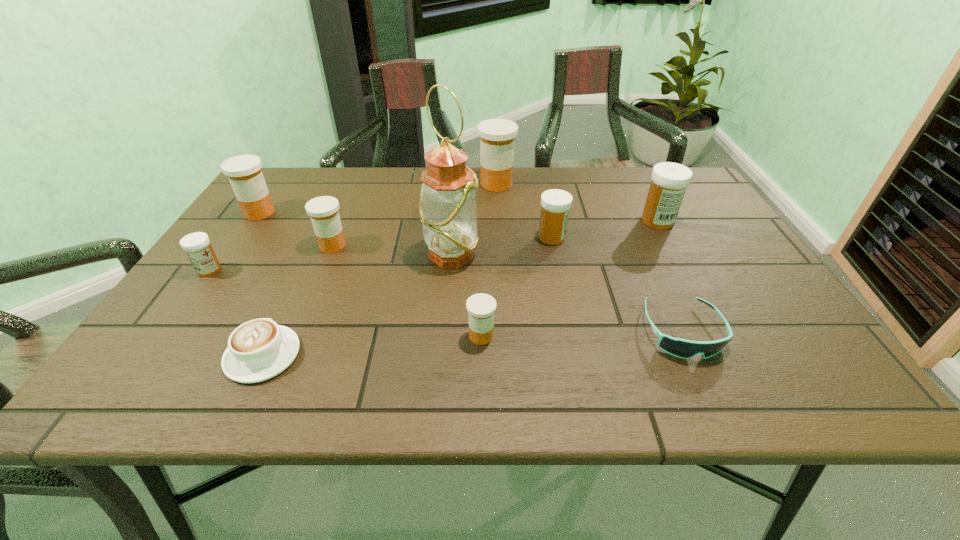
Find the location of `free space located 0.070m on the front-facing side of the sunglasses`. free space located 0.070m on the front-facing side of the sunglasses is located at coordinates (711, 395).

Image resolution: width=960 pixels, height=540 pixels. Identify the location of cappuccino that is at the near edge. (260, 349).

At what (x,y) coordinates should I click in order to perform the action: click on sunglasses present at the near edge. Please return your answer as a coordinate pair (x, y). This screenshot has width=960, height=540. Looking at the image, I should click on (682, 348).

Where is `object present at the right edge`? The height and width of the screenshot is (540, 960). object present at the right edge is located at coordinates (669, 181).

Image resolution: width=960 pixels, height=540 pixels. Find the location of `object situated at the far left corner`. object situated at the far left corner is located at coordinates (244, 172).

In the image, there is a desktop. Identify the location of vacant area at the far edge. The width and height of the screenshot is (960, 540). (615, 179).

At what (x,y) coordinates should I click in order to perform the action: click on vacant region at the near edge. Please return your answer as a coordinate pair (x, y). The image size is (960, 540). Looking at the image, I should click on (566, 382).

Find the location of a particular element. The width and height of the screenshot is (960, 540). vacant space at the left edge is located at coordinates (273, 238).

In order to click on free spot at the right edge of the desktop in this screenshot , I will do `click(745, 286)`.

In the image, there is a desktop. At what (x,y) coordinates should I click in order to perform the action: click on vacant space at the near right corner. Please return your answer as a coordinate pair (x, y). This screenshot has width=960, height=540. Looking at the image, I should click on (778, 372).